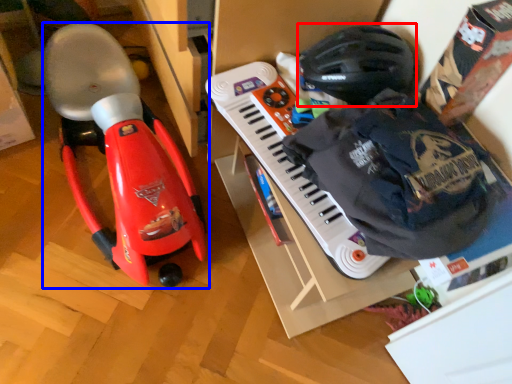
Question: Which object appears closest to the camera in this image, helmet (highlighted by a red box) or toy (highlighted by a blue box)?

Choices:
 (A) helmet
 (B) toy

Answer: (B)